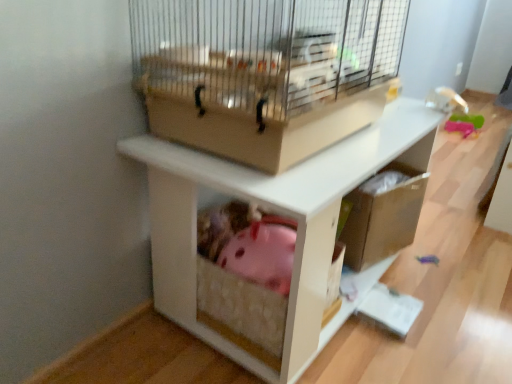
Question: From a real-world perspective, is white matte shelf at center above or below beige wire mesh bird cage at upper center?

Choices:
 (A) above
 (B) below

Answer: (B)

Question: From their relative heights in the image, would you say white matte shelf at center is taller or shorter than beige wire mesh bird cage at upper center?

Choices:
 (A) short
 (B) tall

Answer: (B)

Question: From the image's perspective, relative to beige wire mesh bird cage at upper center, is white matte shelf at center above or below?

Choices:
 (A) above
 (B) below

Answer: (B)

Question: From a real-world perspective, relative to white matte shelf at center, is beige wire mesh bird cage at upper center vertically above or below?

Choices:
 (A) below
 (B) above

Answer: (B)

Question: Considering the positions of point (258, 14) and point (215, 347), is point (258, 14) closer or farther from the camera than point (215, 347)?

Choices:
 (A) farther
 (B) closer

Answer: (B)

Question: In terms of width, does beige wire mesh bird cage at upper center look wider or thinner when compared to white matte shelf at center?

Choices:
 (A) wide
 (B) thin

Answer: (B)

Question: Considering the positions of beige wire mesh bird cage at upper center and white matte shelf at center in the image, is beige wire mesh bird cage at upper center bigger or smaller than white matte shelf at center?

Choices:
 (A) small
 (B) big

Answer: (A)